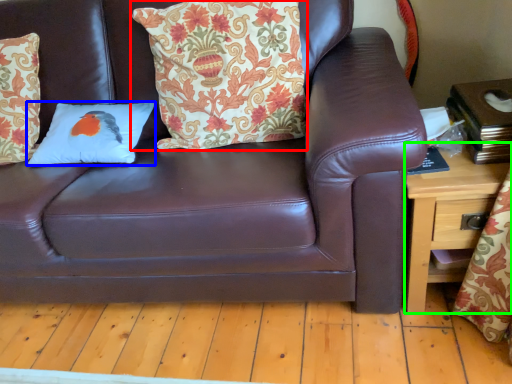
Question: Which object is the closest to the pillow (highlighted by a red box)? Choose among these: pillow (highlighted by a blue box) or table (highlighted by a green box).

Choices:
 (A) pillow
 (B) table

Answer: (A)